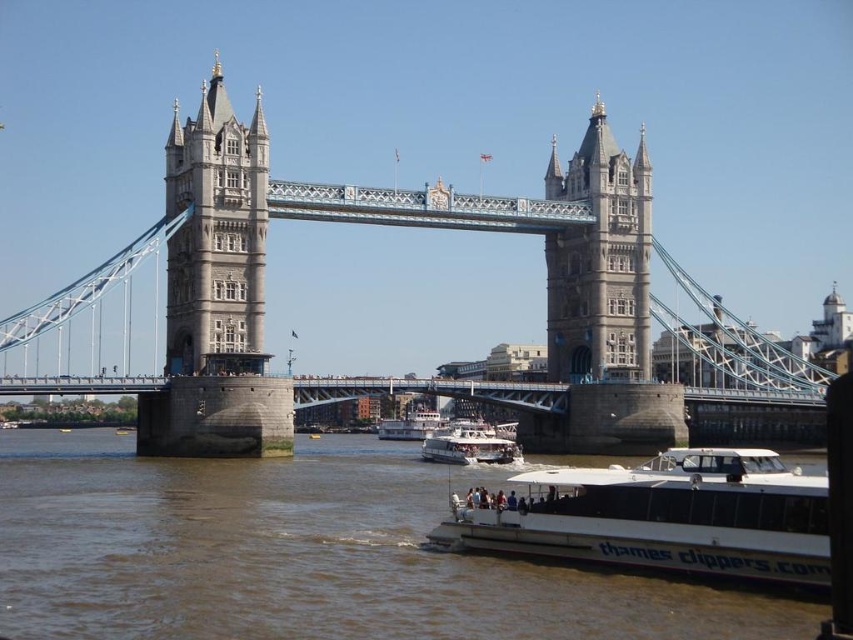
Question: Can you confirm if gray stone tower at center is positioned below white glossy boat at center?

Choices:
 (A) no
 (B) yes

Answer: (A)

Question: Which point is farther from the camera taking this photo?

Choices:
 (A) (149, 608)
 (B) (218, 296)
 (C) (538, 528)

Answer: (B)

Question: Does stone gray suspension bridge at center have a greater width compared to white stone tower at upper left?

Choices:
 (A) yes
 (B) no

Answer: (A)

Question: Which object is closer to the camera taking this photo?

Choices:
 (A) white glossy boat at center
 (B) brown water at lower center
 (C) white stone tower at upper left

Answer: (B)

Question: Which of these objects is positioned farthest from the white matte boat at center?

Choices:
 (A) brown water at lower center
 (B) gray stone tower at center

Answer: (A)

Question: Is white matte boat at lower right above white glossy boat at center?

Choices:
 (A) no
 (B) yes

Answer: (A)